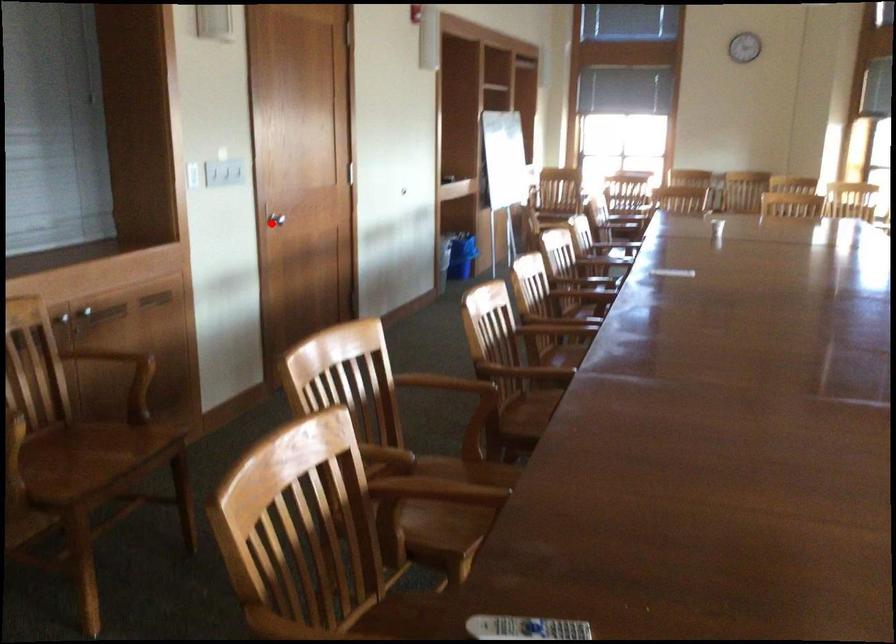
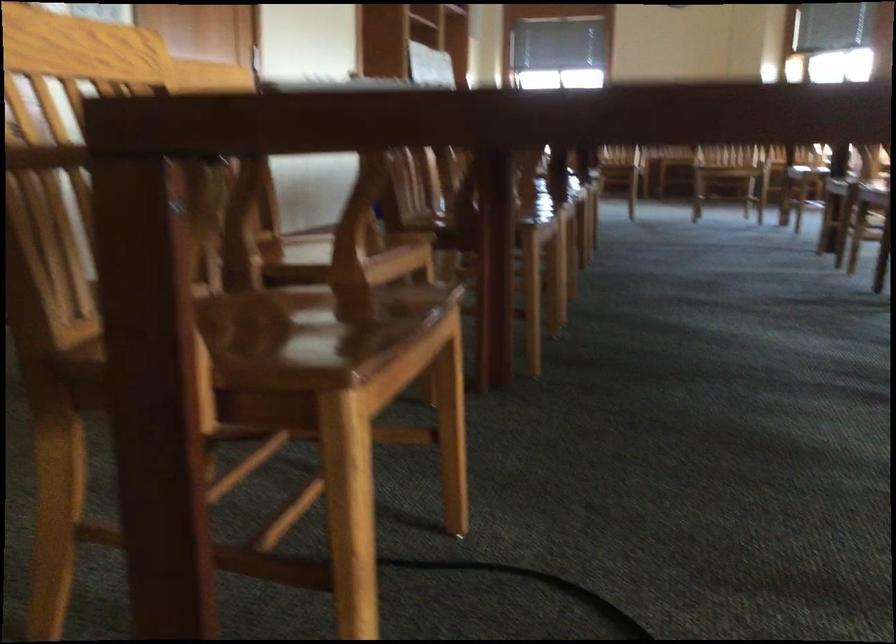
Question: I am providing you with two images of the same scene from different viewpoints. A red point is marked on the first image. Is the red point's position out of view in image 2?

Choices:
 (A) Yes
 (B) No

Answer: (A)